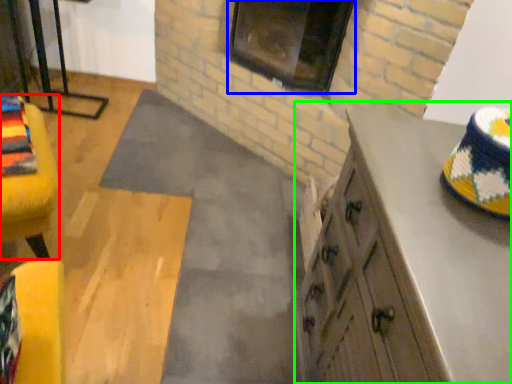
Question: Considering the real-world distances, which object is closest to furniture (highlighted by a red box)? window (highlighted by a blue box) or cabinetry (highlighted by a green box).

Choices:
 (A) window
 (B) cabinetry

Answer: (B)